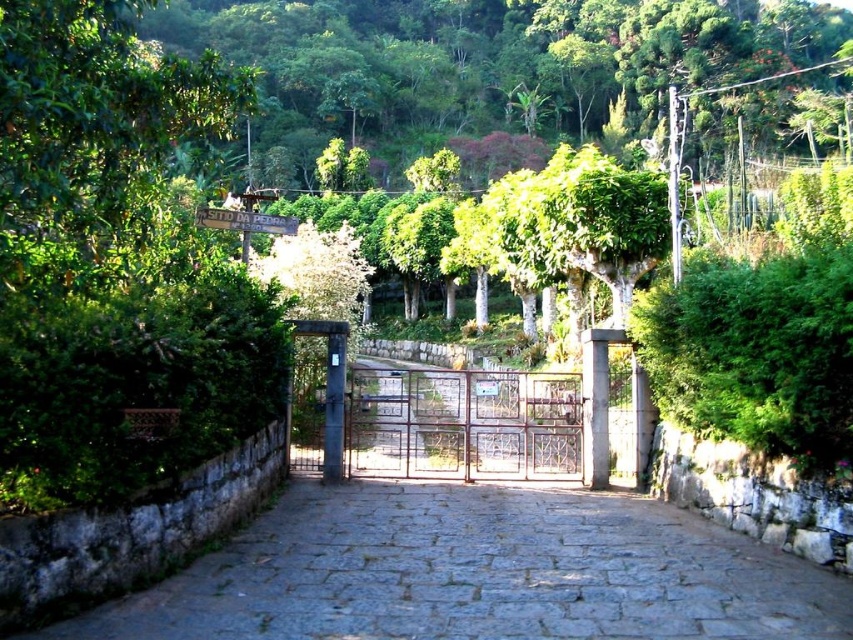
Identify the location of gray stone path at center. (479, 573).

Who is lower down, gray stone path at center or metallic gate at center?

gray stone path at center

What are the coordinates of `gray stone path at center` in the screenshot? It's located at click(x=479, y=573).

Locate an element on the screen. The width and height of the screenshot is (853, 640). gray stone path at center is located at coordinates (479, 573).

Is point (469, 467) farther from camera compared to point (325, 403)?

Yes, it is.

Identify the location of metallic gate at center. Image resolution: width=853 pixels, height=640 pixels. (463, 422).

Where is `metallic gate at center`? The image size is (853, 640). metallic gate at center is located at coordinates (463, 422).

Does point (218, 589) lie in front of point (340, 406)?

Yes, it is in front of point (340, 406).

Is gray stone path at center shorter than metal gate at center?

Indeed, gray stone path at center has a lesser height compared to metal gate at center.

At what (x,y) coordinates should I click in order to perform the action: click on gray stone path at center. Please return your answer as a coordinate pair (x, y). This screenshot has height=640, width=853. Looking at the image, I should click on (479, 573).

Find the location of a particular element. gray stone path at center is located at coordinates (479, 573).